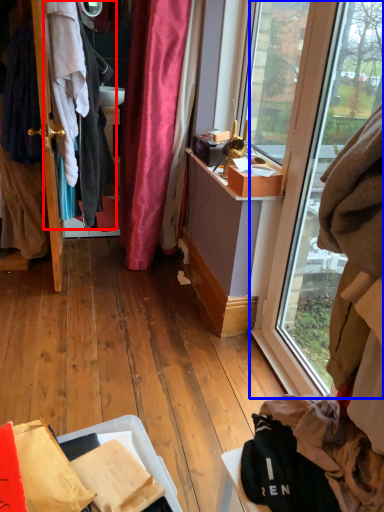
Question: Which point is closer to the camera, clothing (highlighted by a red box) or window (highlighted by a blue box)?

Choices:
 (A) clothing
 (B) window

Answer: (B)